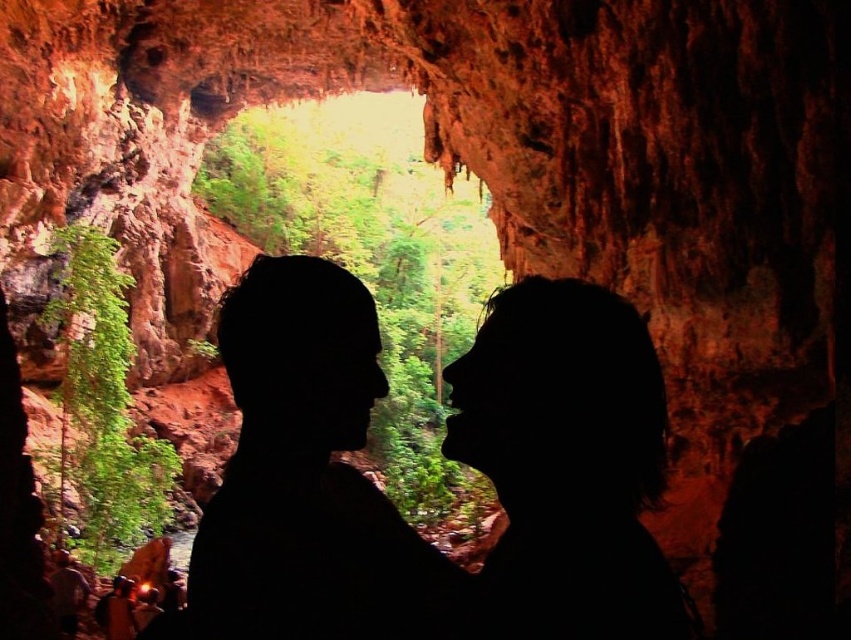
Question: Among these objects, which one is farthest from the camera?

Choices:
 (A) silhouette hair at center
 (B) black silhouette couple at center

Answer: (A)

Question: Does black silhouette couple at center appear under silhouette hair at center?

Choices:
 (A) no
 (B) yes

Answer: (B)

Question: Is black silhouette couple at center bigger than silhouette hair at center?

Choices:
 (A) yes
 (B) no

Answer: (A)

Question: Among these points, which one is farthest from the camera?

Choices:
 (A) (505, 349)
 (B) (498, 326)

Answer: (B)

Question: Is black silhouette couple at center thinner than silhouette hair at center?

Choices:
 (A) yes
 (B) no

Answer: (B)